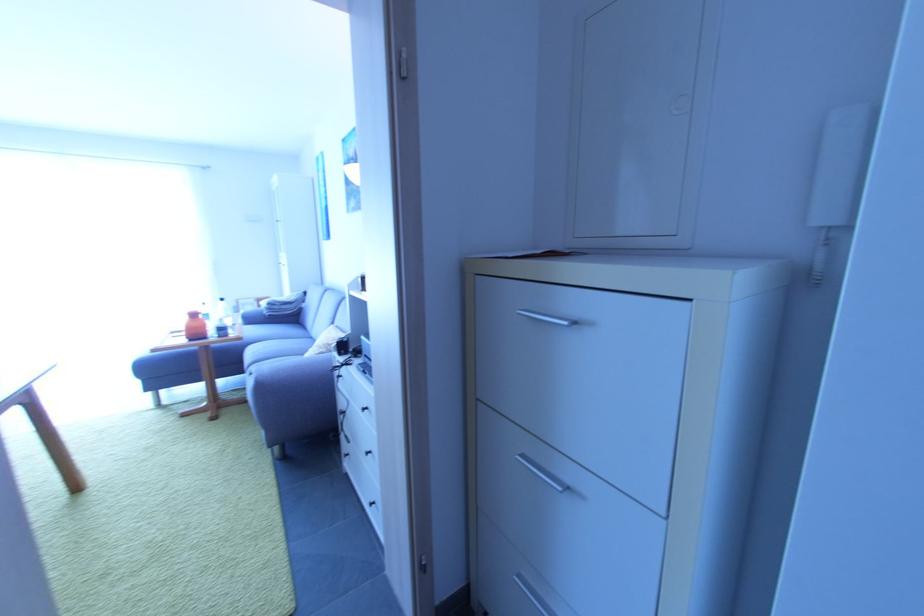
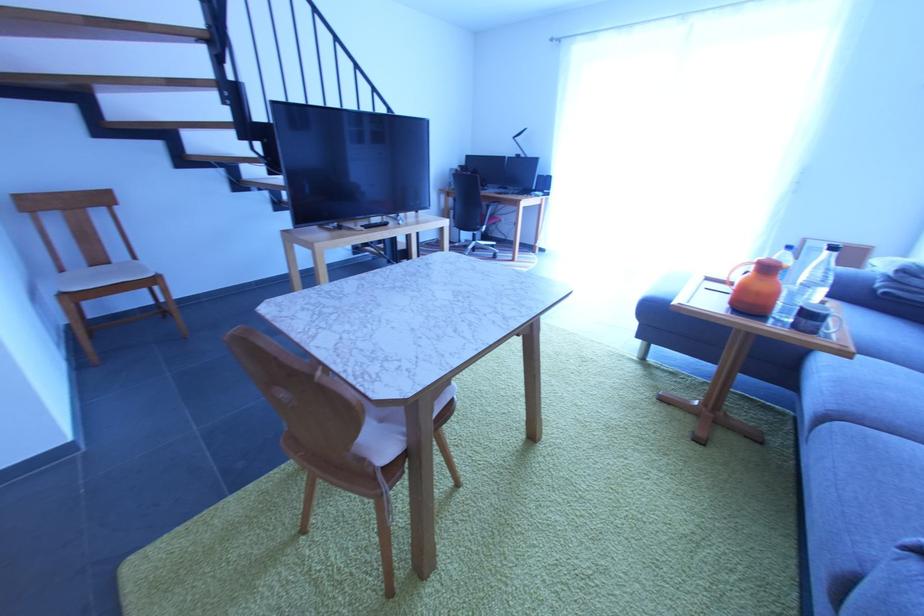
Where in the second image is the point corresponding to [232,338] from the first image?

(819, 334)